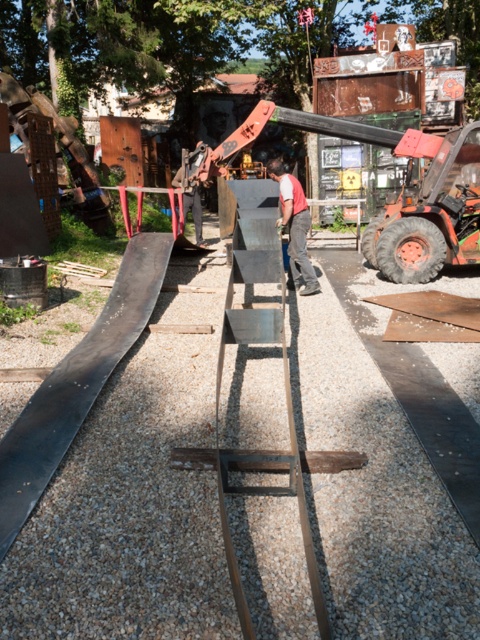
Between point (256, 314) and point (302, 252), which one is positioned behind?

Point (302, 252)

Between metallic gray ladder at center and red cotton shirt at center, which one appears on the left side from the viewer's perspective?

metallic gray ladder at center is more to the left.

What are the coordinates of `metallic gray ladder at center` in the screenshot? It's located at (283, 371).

Looking at this image, who is more distant from viewer, (277, 454) or (435, 253)?

Positioned behind is point (435, 253).

Who is higher up, metallic gray ladder at center or rusty metal forklift at center?

Positioned higher is rusty metal forklift at center.

Where is `metallic gray ladder at center`? metallic gray ladder at center is located at coordinates (283, 371).

Which is behind, point (421, 266) or point (299, 243)?

The point (421, 266) is more distant.

Can you confirm if rusty metal forklift at center is positioned to the right of red cotton shirt at center?

Yes, rusty metal forklift at center is to the right of red cotton shirt at center.

Describe the element at coordinates (431, 216) in the screenshot. Image resolution: width=480 pixels, height=640 pixels. I see `rusty metal forklift at center` at that location.

This screenshot has height=640, width=480. I want to click on rusty metal forklift at center, so click(x=431, y=216).